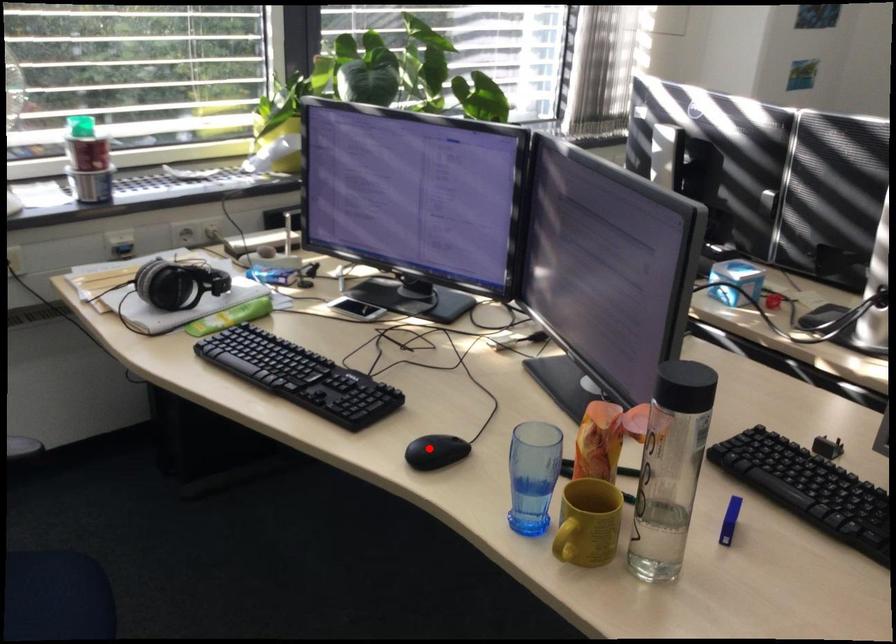
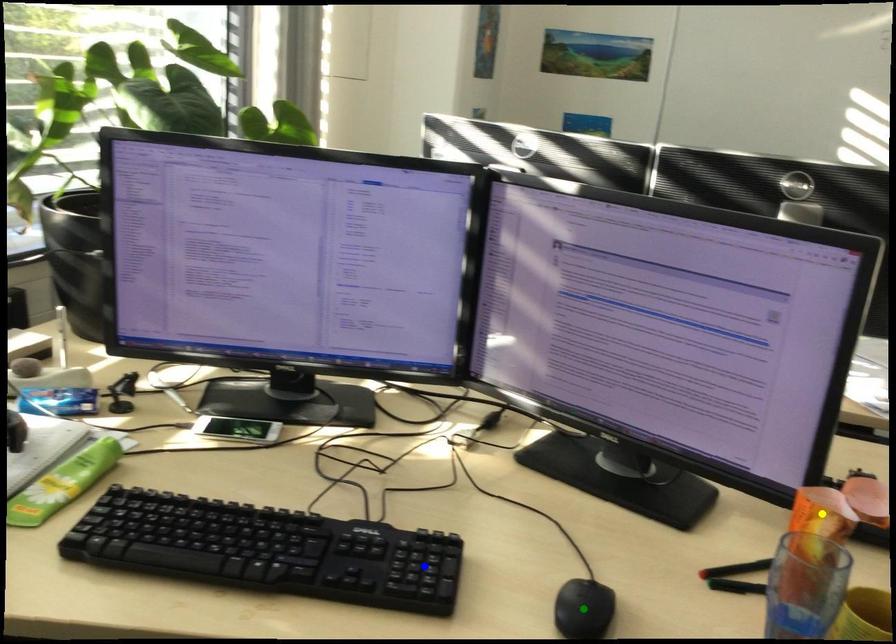
Question: I am providing you with two images of the same scene from different viewpoints. A red point is marked on the first image. You are given multiple points on the second image. Which point in image 2 is actually the same real-world point as the red point in image 1?

Choices:
 (A) blue point
 (B) green point
 (C) yellow point

Answer: (B)